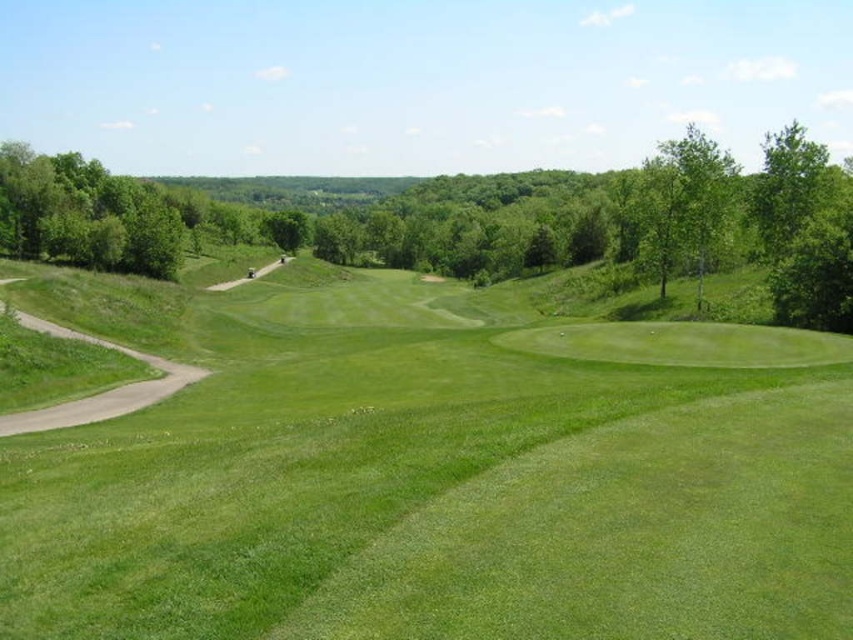
You are a golfer standing on the green grassy golf course at center and want to hit a ball towards the green leafy tree at center. Since both are at the center, which direction should you aim to reach the tree?

The green leafy tree at center is wider than the green grassy golf course at center, so you should aim towards the center where the tree is located, as it occupies a larger area.

You are a golfer standing at the starting tee. You see two points marked on the course. The first point is at coordinates point (195,419) and the second point is at point (688,230). Which point is closer to you as you stand at the tee? Please answer based on their positions relative to each other.

Point (195,419) is in front of point (688,230), so the first point is closer to you.